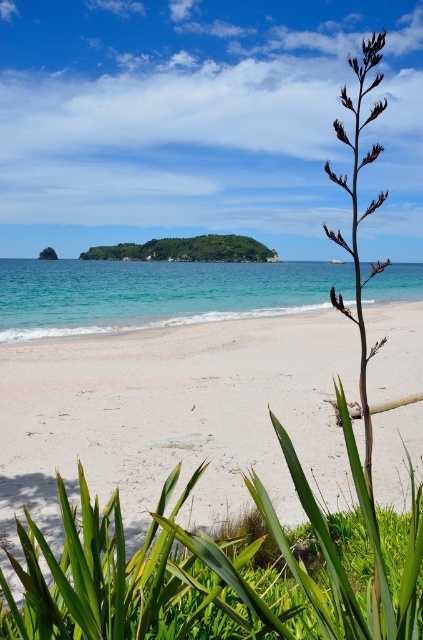
Is turquoise water at center to the left of green leafy island at center from the viewer's perspective?

No, turquoise water at center is not to the left of green leafy island at center.

Who is more distant from viewer, (252, 269) or (129, 243)?

The point (129, 243) is more distant.

Who is more forward, (320, 275) or (208, 236)?

Point (320, 275) is in front.

This screenshot has height=640, width=423. In order to click on turquoise water at center in this screenshot , I will do `click(154, 292)`.

Can you confirm if white sandy beach at center is bigger than turquoise water at center?

No.

Can you confirm if white sandy beach at center is positioned above turquoise water at center?

No.

The width and height of the screenshot is (423, 640). What are the coordinates of `white sandy beach at center` in the screenshot? It's located at (175, 417).

This screenshot has width=423, height=640. What do you see at coordinates (175, 417) in the screenshot?
I see `white sandy beach at center` at bounding box center [175, 417].

Describe the element at coordinates (175, 417) in the screenshot. The width and height of the screenshot is (423, 640). I see `white sandy beach at center` at that location.

Locate an element on the screen. Image resolution: width=423 pixels, height=640 pixels. white sandy beach at center is located at coordinates (175, 417).